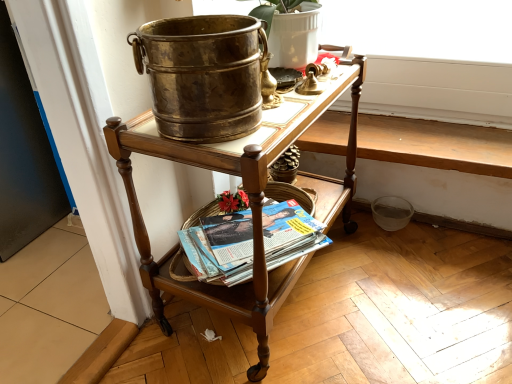
Question: Could you tell me if polished wood desk at center is turned towards matte paperbacks at lower center?

Choices:
 (A) no
 (B) yes

Answer: (B)

Question: Is polished wood desk at center shorter than matte paperbacks at lower center?

Choices:
 (A) yes
 (B) no

Answer: (B)

Question: Does polished wood desk at center have a smaller size compared to matte paperbacks at lower center?

Choices:
 (A) yes
 (B) no

Answer: (B)

Question: From the image's perspective, is polished wood desk at center located beneath matte paperbacks at lower center?

Choices:
 (A) yes
 (B) no

Answer: (B)

Question: Would you consider polished wood desk at center to be distant from matte paperbacks at lower center?

Choices:
 (A) yes
 (B) no

Answer: (B)

Question: From the image's perspective, is polished wood desk at center located above matte paperbacks at lower center?

Choices:
 (A) yes
 (B) no

Answer: (A)

Question: Is matte paperbacks at lower center behind polished wood desk at center?

Choices:
 (A) no
 (B) yes

Answer: (B)

Question: Can you confirm if matte paperbacks at lower center is shorter than polished wood desk at center?

Choices:
 (A) yes
 (B) no

Answer: (A)

Question: From the image's perspective, would you say matte paperbacks at lower center is shown under polished wood desk at center?

Choices:
 (A) yes
 (B) no

Answer: (A)

Question: From a real-world perspective, is matte paperbacks at lower center below polished wood desk at center?

Choices:
 (A) yes
 (B) no

Answer: (A)

Question: Is matte paperbacks at lower center thinner than polished wood desk at center?

Choices:
 (A) yes
 (B) no

Answer: (A)

Question: From a real-world perspective, is matte paperbacks at lower center over polished wood desk at center?

Choices:
 (A) yes
 (B) no

Answer: (B)

Question: Does matte white flowerpot at upper center have a lesser height compared to matte paperbacks at lower center?

Choices:
 (A) yes
 (B) no

Answer: (B)